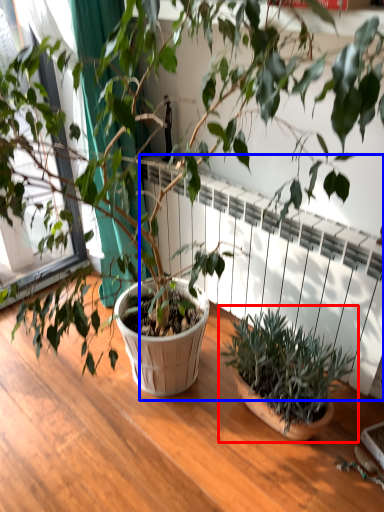
Question: Among these objects, which one is nearest to the camera, houseplant (highlighted by a red box) or radiator (highlighted by a blue box)?

Choices:
 (A) houseplant
 (B) radiator

Answer: (A)